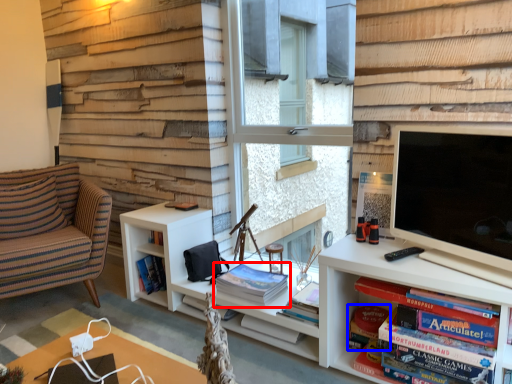
Question: Which object appears closest to the camera in this image, book (highlighted by a red box) or paperback book (highlighted by a blue box)?

Choices:
 (A) book
 (B) paperback book

Answer: (B)